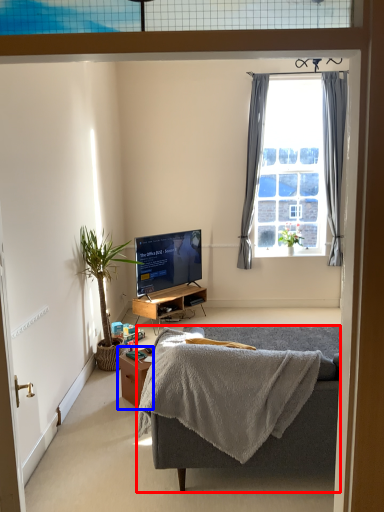
Question: Which point is closer to the camera, studio couch (highlighted by a red box) or table (highlighted by a blue box)?

Choices:
 (A) studio couch
 (B) table

Answer: (A)